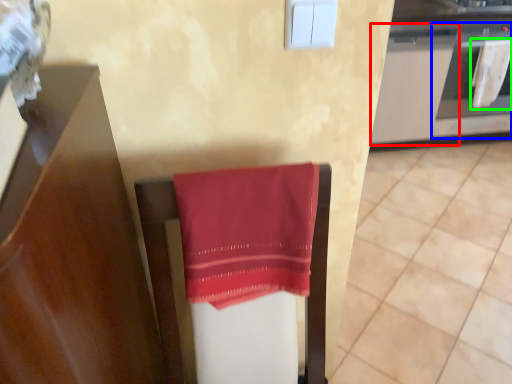
Question: Which object is positioned farthest from cabinetry (highlighted by a red box)? Select from oven (highlighted by a blue box) and beach towel (highlighted by a green box).

Choices:
 (A) oven
 (B) beach towel

Answer: (B)